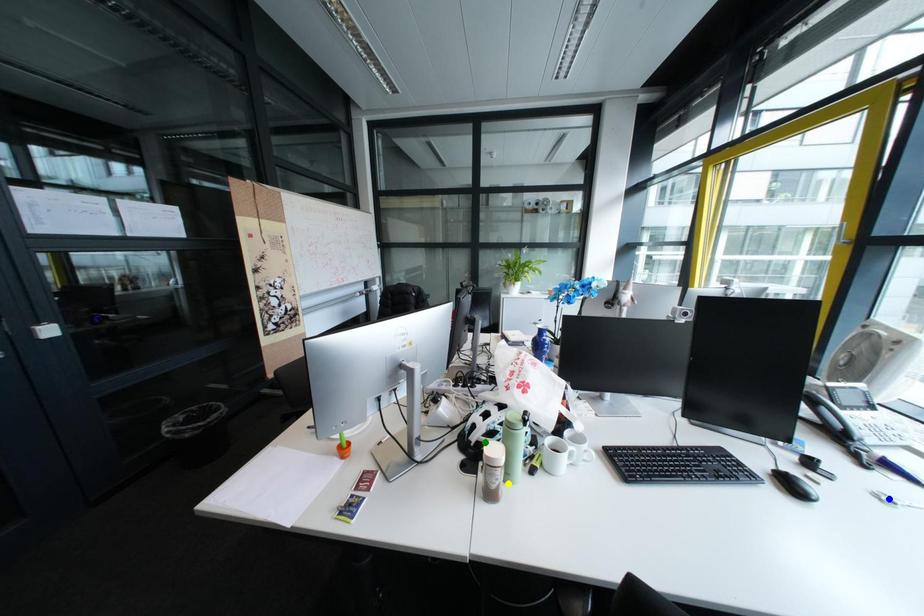
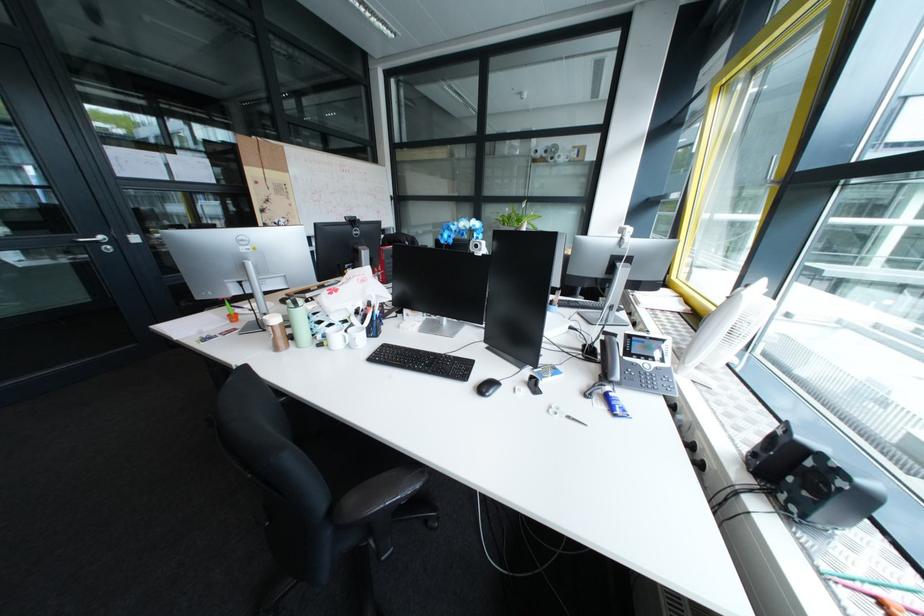
I am providing you with two images of the same scene from different viewpoints. Three points are marked in image1. Which point corresponds to a part or object that is occluded in image2?In image1, three points are marked. Which of them correspond to a part or object that is occluded in image2?Among the three points shown in image1, which one corresponds to a part or object that is no longer visible due to occlusion in image2?

green point cannot be seen in image2.